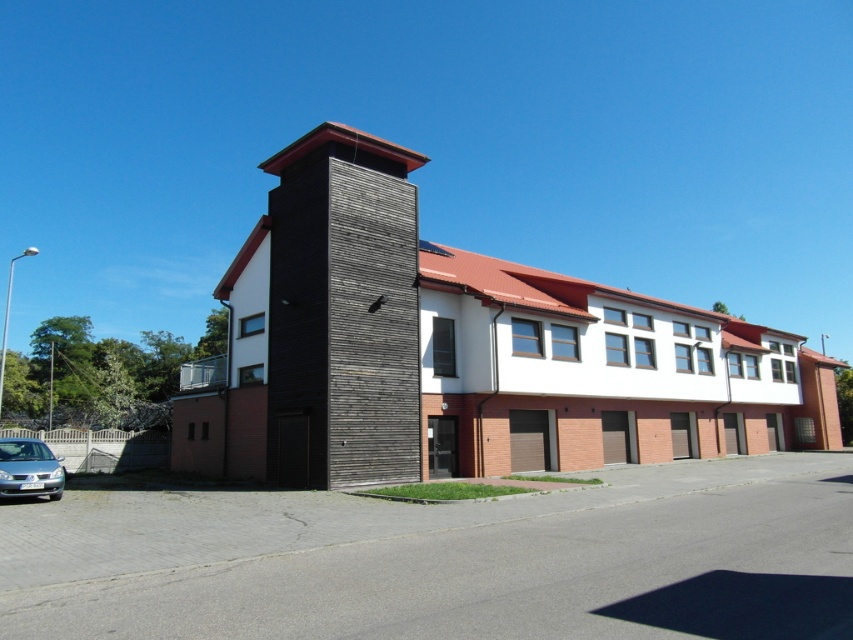
Question: Can you confirm if dark brown wood at center is wider than silver metallic car at lower left?

Choices:
 (A) yes
 (B) no

Answer: (A)

Question: Considering the relative positions of dark brown wood at center and silver metallic car at lower left in the image provided, where is dark brown wood at center located with respect to silver metallic car at lower left?

Choices:
 (A) below
 (B) above

Answer: (B)

Question: Can you confirm if dark brown wood at center is positioned to the left of silver metallic car at lower left?

Choices:
 (A) yes
 (B) no

Answer: (B)

Question: Which point is farther to the camera?

Choices:
 (A) 38,468
 (B) 373,465

Answer: (B)